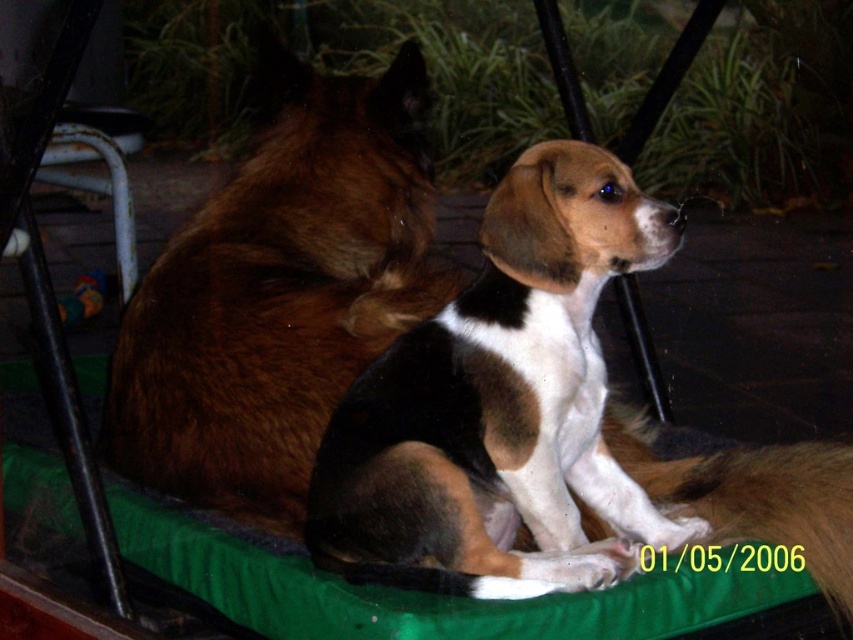
Is tri-colored fur dog at center below brown furry dog at center?

Correct, tri-colored fur dog at center is located below brown furry dog at center.

Between tri-colored fur dog at center and brown furry dog at center, which one has more height?

Standing taller between the two is brown furry dog at center.

Between point (462, 513) and point (413, 163), which one is positioned in front?

Point (462, 513) is in front.

The width and height of the screenshot is (853, 640). What are the coordinates of `tri-colored fur dog at center` in the screenshot? It's located at (502, 406).